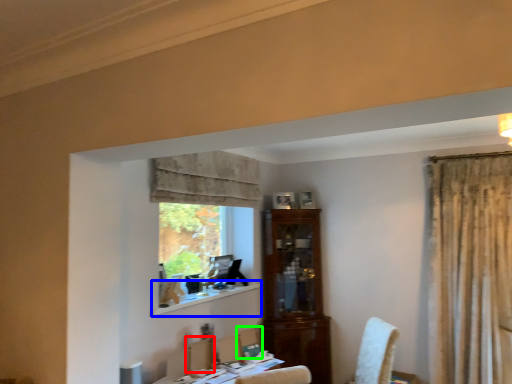
Question: Considering the real-world distances, which object is closest to armchair (highlighted by a red box)? window sill (highlighted by a blue box) or chair (highlighted by a green box).

Choices:
 (A) window sill
 (B) chair

Answer: (B)